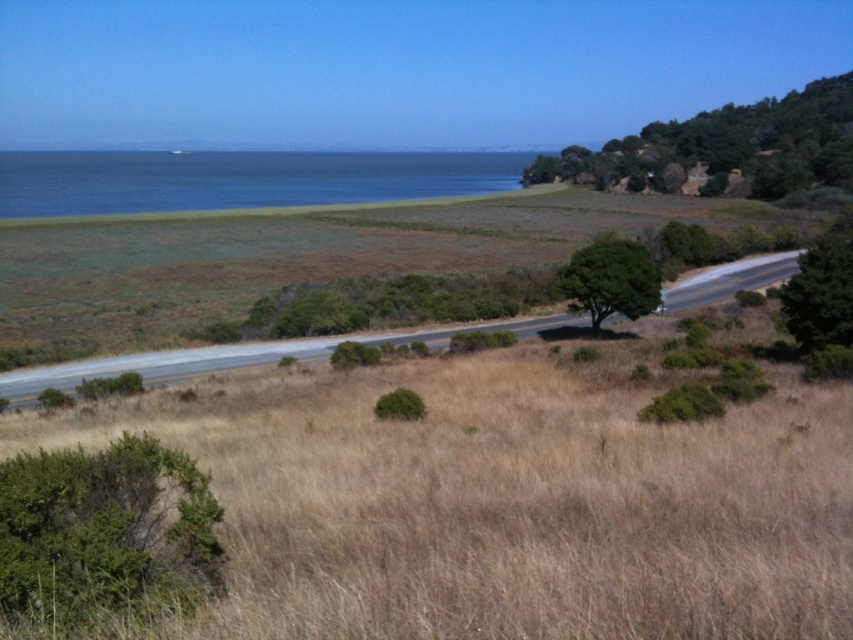
You are standing on the paved road in the middle of the scene. You see the green leafy bush at lower left and the green leafy tree at upper right. Which one is closer to you?

The green leafy bush at lower left is closer to the viewer than the green leafy tree at upper right.